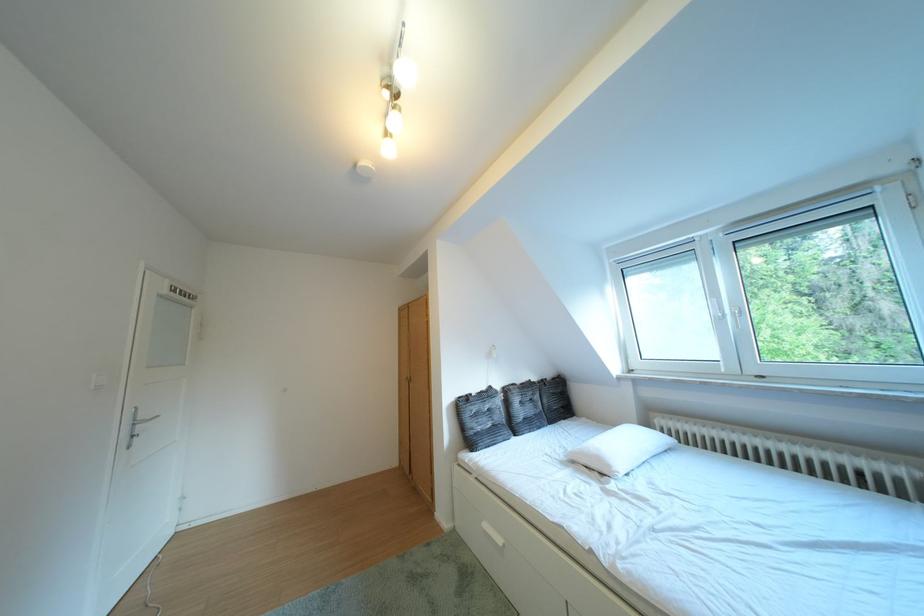
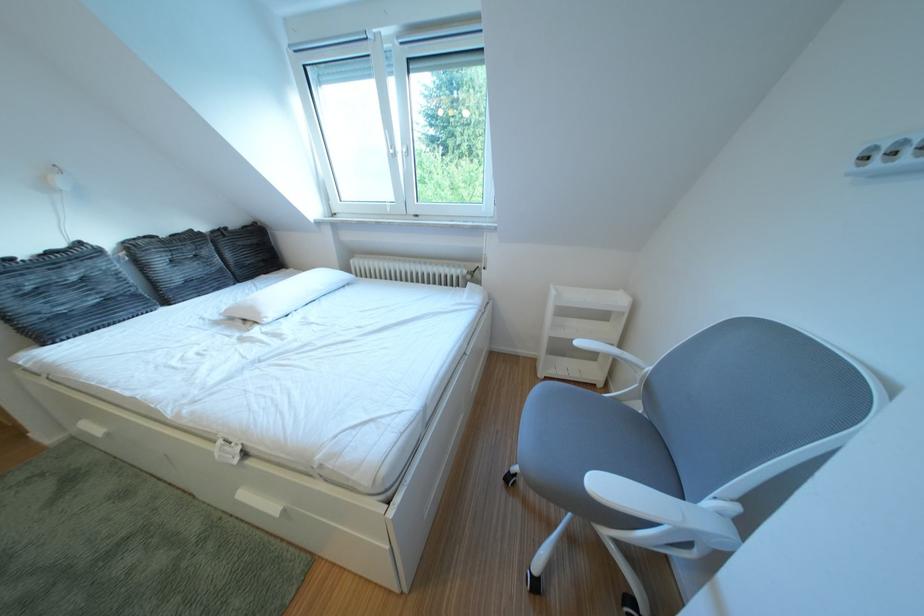
Find the pixel in the second image that matches point 623,471 in the first image.

(273, 318)